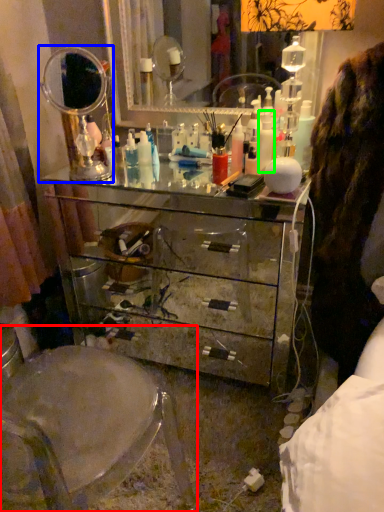
Question: Estimate the real-world distances between objects in this image. Which object is farther from swivel chair (highlighted by a red box), mirror (highlighted by a blue box) or toiletry (highlighted by a green box)?

Choices:
 (A) mirror
 (B) toiletry

Answer: (B)